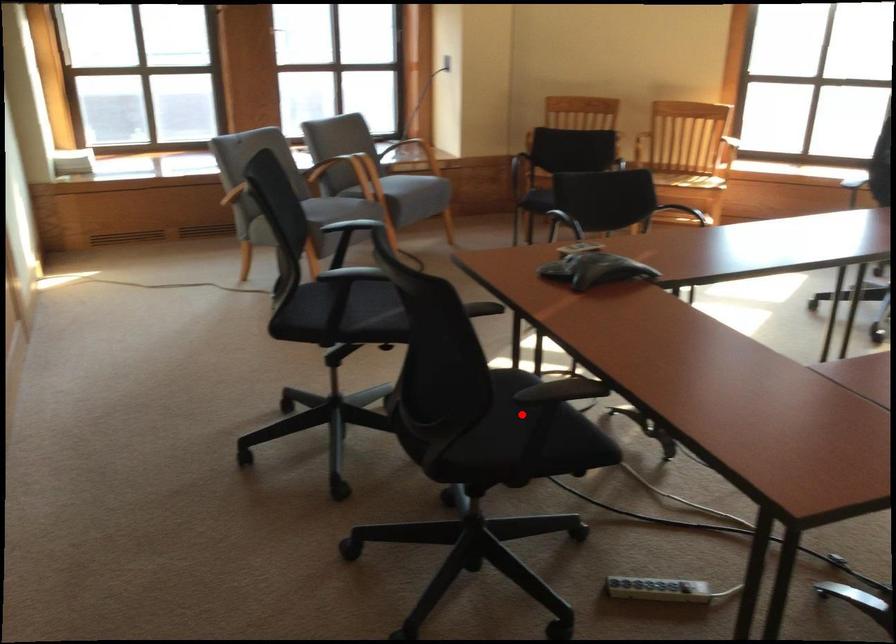
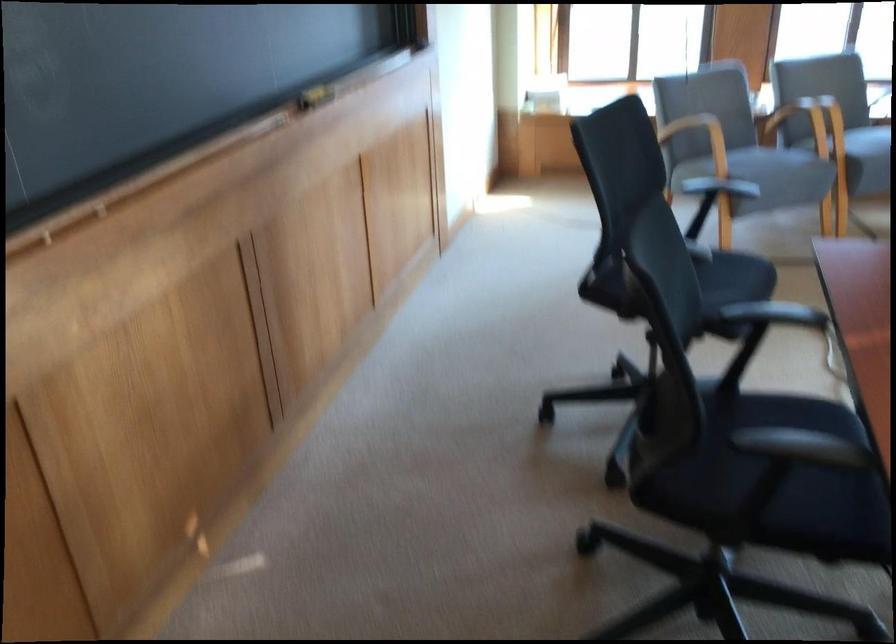
Find the pixel in the second image that matches the highlighted location in the first image.

(789, 477)